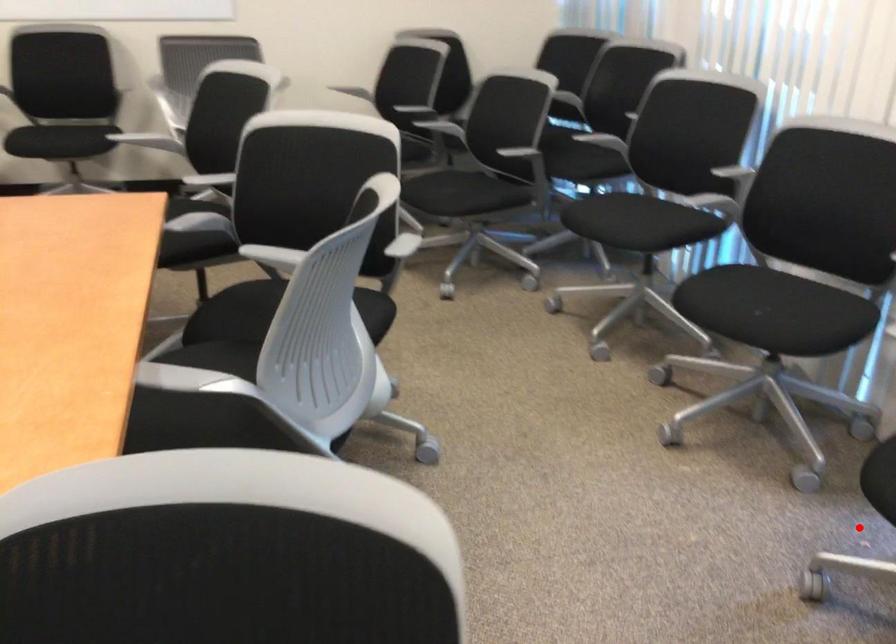
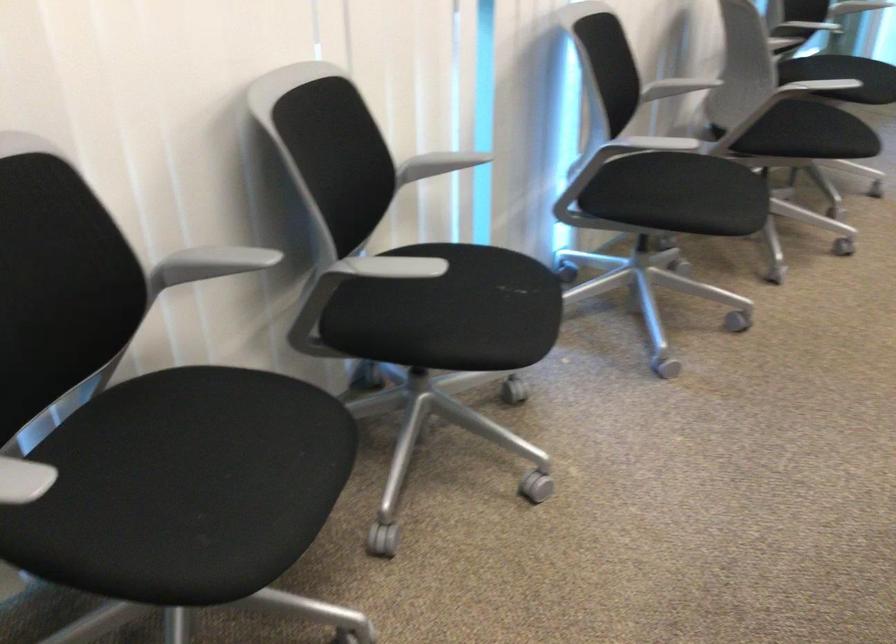
Question: I am providing you with two images of the same scene from different viewpoints. A red point is marked on the first image. Can you still see the location of the red point in image 2?

Choices:
 (A) Yes
 (B) No

Answer: (B)